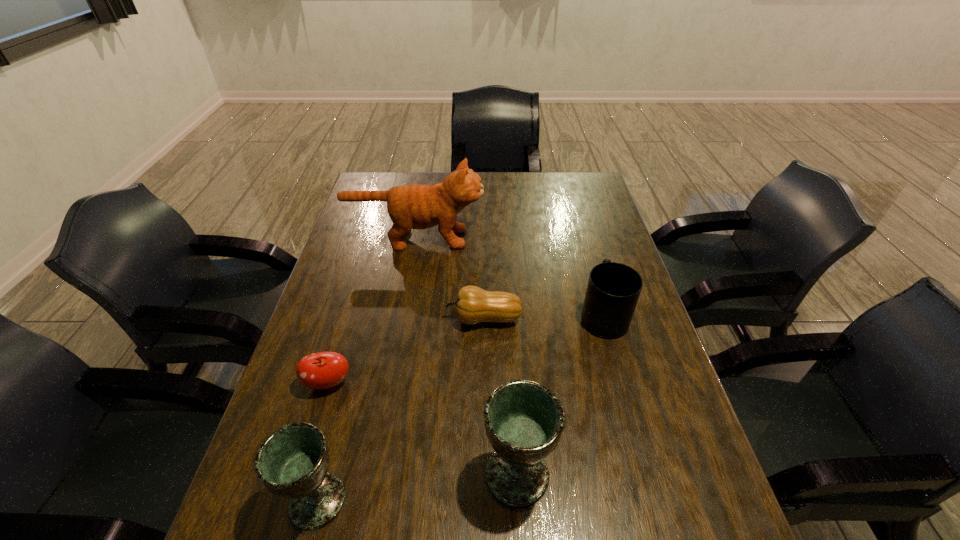
Identify which object is located as the fifth nearest to the third tallest object. Please provide its 2D coordinates. Your answer should be formatted as a tuple, i.e. [(x, y)], where the tuple contains the x and y coordinates of a point satisfying the conditions above.

[(415, 206)]

Select which object is the closest to the mug. Please provide its 2D coordinates. Your answer should be formatted as a tuple, i.e. [(x, y)], where the tuple contains the x and y coordinates of a point satisfying the conditions above.

[(473, 305)]